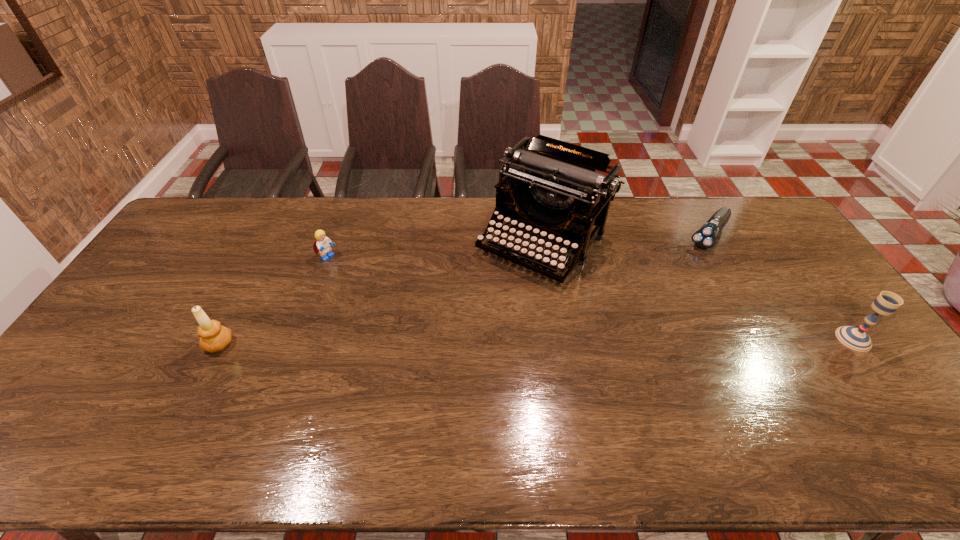
Where is `free space between the Lego and the chalice`? The image size is (960, 540). free space between the Lego and the chalice is located at coordinates (590, 299).

Locate an element on the screen. empty space between the leftmost object and the Lego is located at coordinates (274, 301).

The image size is (960, 540). Identify the location of vacant space in between the shortest object and the leftmost object. (464, 290).

The image size is (960, 540). I want to click on free space between the typewriter and the fourth tallest object, so click(435, 251).

Where is `empty space that is in between the leftmost object and the electric shaver`? Image resolution: width=960 pixels, height=540 pixels. empty space that is in between the leftmost object and the electric shaver is located at coordinates (464, 290).

Where is `vacant area that lies between the rightmost object and the electric shaver`? vacant area that lies between the rightmost object and the electric shaver is located at coordinates (781, 287).

What are the coordinates of `free space that is in between the shortest object and the third object from left to right` in the screenshot? It's located at (626, 239).

Identify which object is located as the nearest to the rightmost object. Please provide its 2D coordinates. Your answer should be formatted as a tuple, i.e. [(x, y)], where the tuple contains the x and y coordinates of a point satisfying the conditions above.

[(705, 237)]

Identify which object is the fourth closest to the fourth tallest object. Please provide its 2D coordinates. Your answer should be formatted as a tuple, i.e. [(x, y)], where the tuple contains the x and y coordinates of a point satisfying the conditions above.

[(886, 303)]

The image size is (960, 540). I want to click on vacant position in the image that satisfies the following two spatial constraints: 1. on the back side of the shortest object; 2. on the left side of the leftmost object, so click(275, 236).